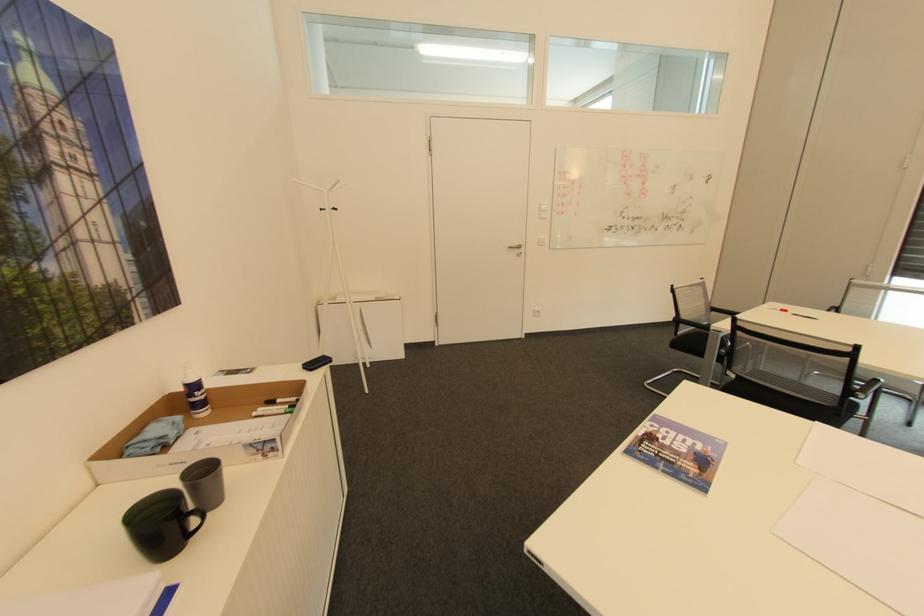
The height and width of the screenshot is (616, 924). In order to click on white light switch in this screenshot , I will do `click(542, 211)`.